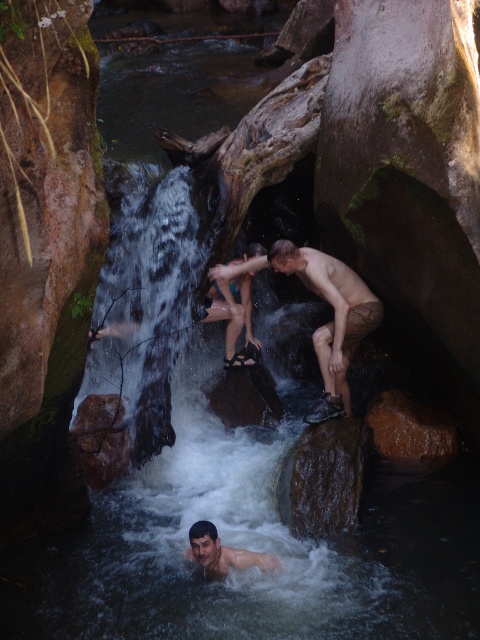
Based on the scene description, which of the two men, the smooth skin man at center or the smooth skin man at lower center, appears larger in size?

The smooth skin man at center appears larger in size than the smooth skin man at lower center according to the description.